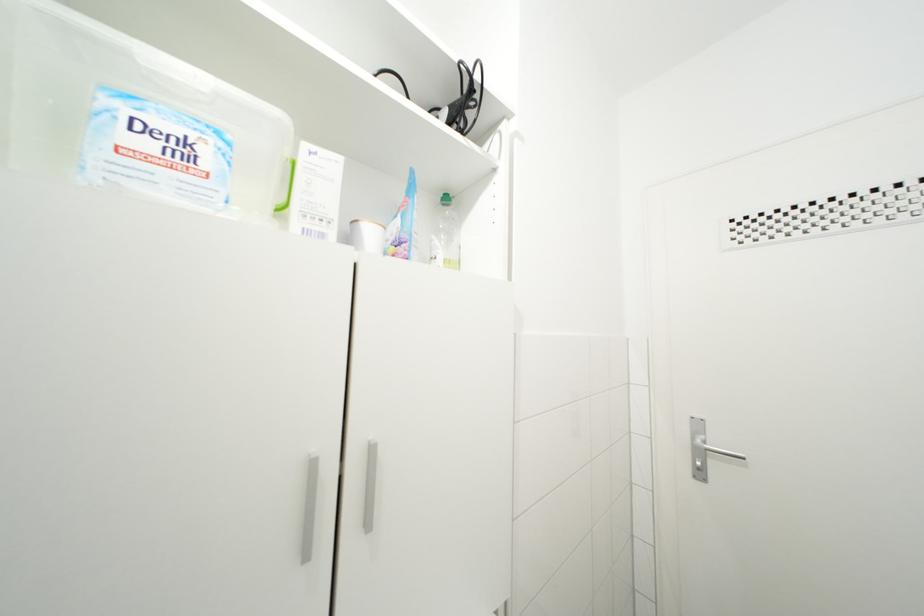
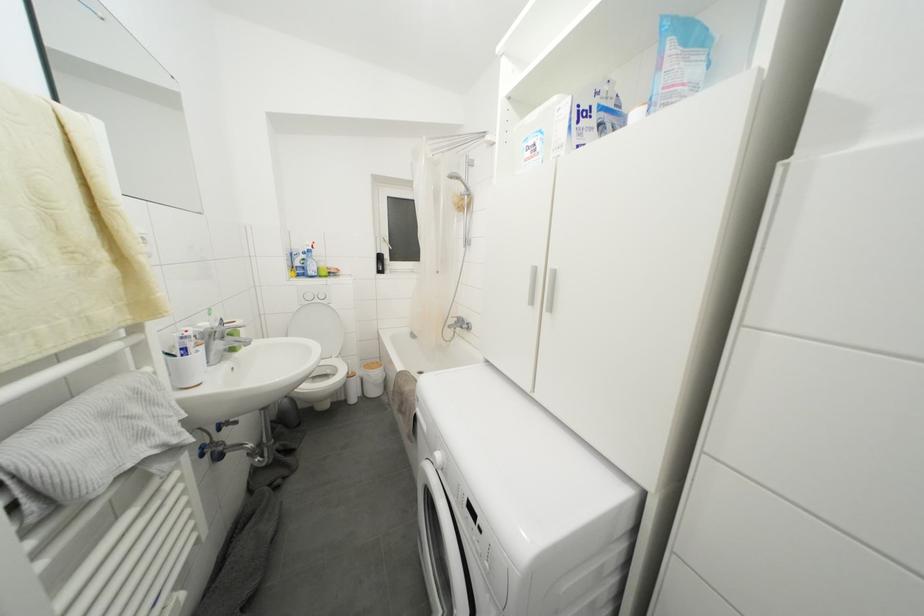
Question: The images are taken continuously from a first-person perspective. In which direction is your viewpoint rotating?

Choices:
 (A) Left
 (B) Right
 (C) Up
 (D) Down

Answer: (A)